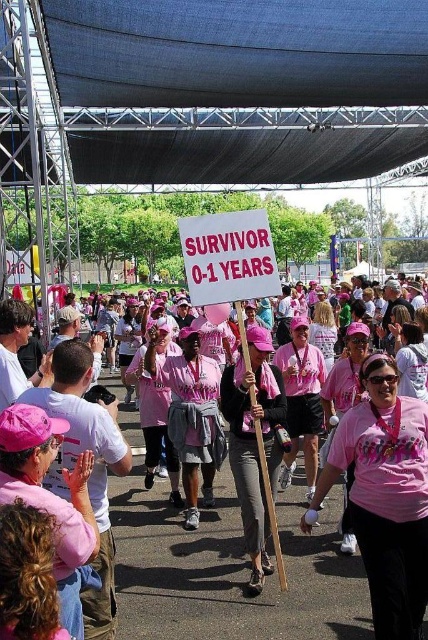
You are a photographer at the event and want to take a photo of the pink fabric sign at center and another participant holding a sign 17.45 meters away. Can you fit both signs in the same frame if your camera has a 50mm lens?

The distance between the pink fabric sign at center and the other participant holding a sign is 17.45 meters. With a 50mm lens, which has a moderate field of view, it might be challenging to capture both signs in the same frame if they are that far apart. You may need to use a wider lens or move closer to ensure both are visible.

You are organizing a photo shoot for the event and want to ensure both the pink matte shirt at center and the pink fabric shirt at center are clearly visible in the frame. Given their sizes, which shirt should you focus on to ensure it takes up more space in the photo?

The pink fabric shirt at center should be focused on because it occupies more space than the pink matte shirt at center, making it easier to capture its details clearly in the photo.

Based on the photo, you are a photographer at the event and want to capture a clear shot of both the pink fabric sign at center and the pink matte shirt at center. However, your camera has a limited field of view. Based on their sizes, can you fit both objects in the frame without zooming out?

The pink fabric sign at center might be wider than pink matte shirt at center, so there is a possibility that both can fit in the frame if the sign isn not excessively wide. However, without exact measurements, it is uncertain. Consider adjusting your position or angle to accommodate both.